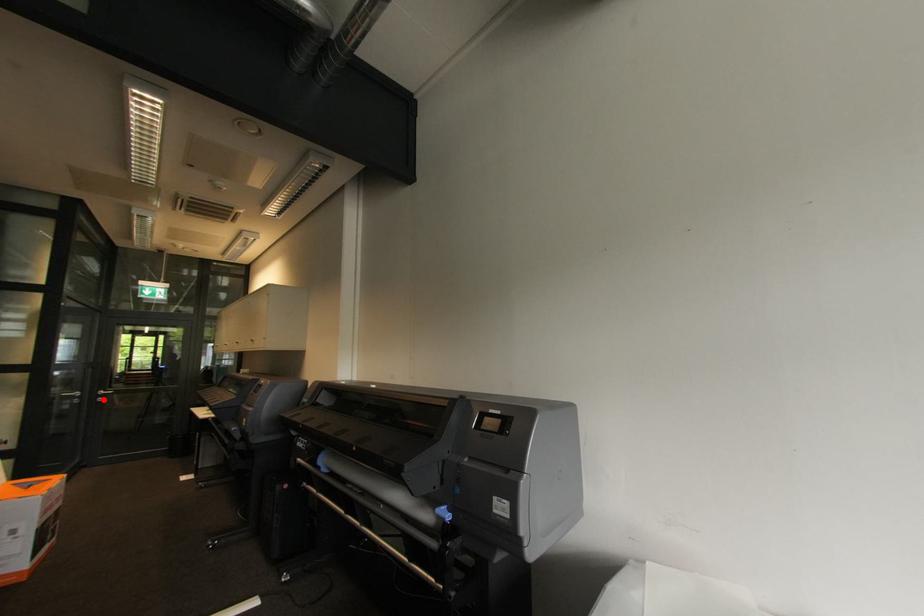
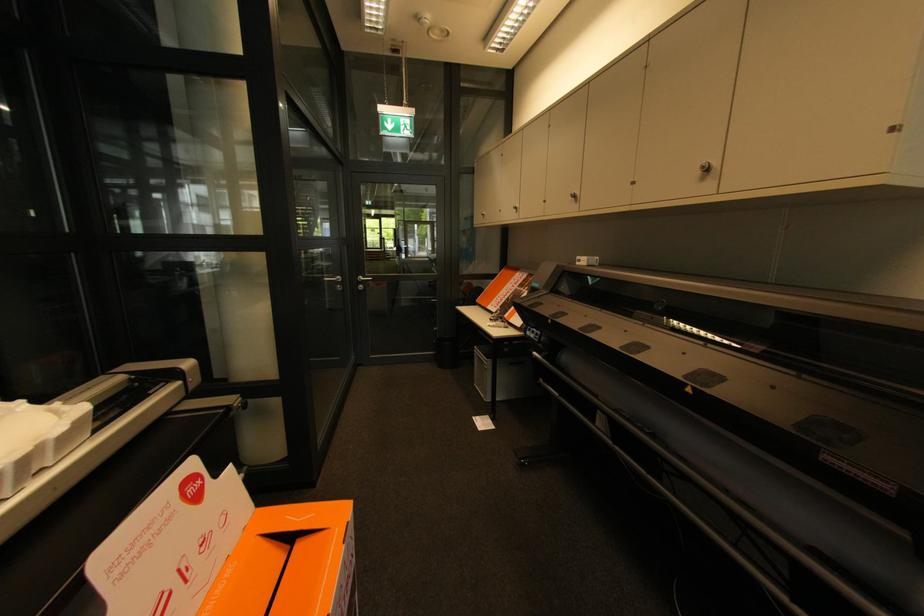
The point at the highlighted location is marked in the first image. Where is the corresponding point in the second image?

(365, 286)